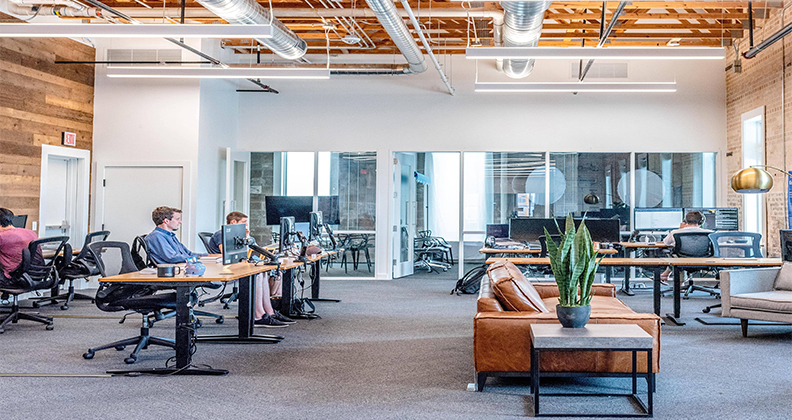
Where is `monitor`? The height and width of the screenshot is (420, 792). monitor is located at coordinates (234, 234), (284, 232), (310, 222), (303, 209), (534, 224), (503, 229), (595, 231), (576, 221), (642, 219), (714, 213).